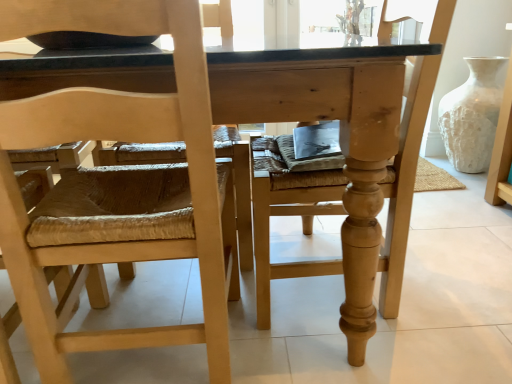
Question: Is natural wood chair at center, the 2th chair viewed from the left, situated inside natural wood chair at left, the second chair viewed from the right, or outside?

Choices:
 (A) outside
 (B) inside

Answer: (A)

Question: Does point (423, 74) appear closer or farther from the camera than point (193, 208)?

Choices:
 (A) farther
 (B) closer

Answer: (A)

Question: Estimate the real-world distances between objects in this image. Which object is closer to the natural wood chair at center, the first chair when ordered from right to left?

Choices:
 (A) natural wood table at center
 (B) natural wood chair at left, placed as the first chair when sorted from left to right
 (C) white textured vase at right

Answer: (A)

Question: Which of these objects is positioned farthest from the natural wood chair at left, the second chair viewed from the right?

Choices:
 (A) natural wood table at center
 (B) white textured vase at right
 (C) natural wood chair at center, the 2th chair viewed from the left

Answer: (B)